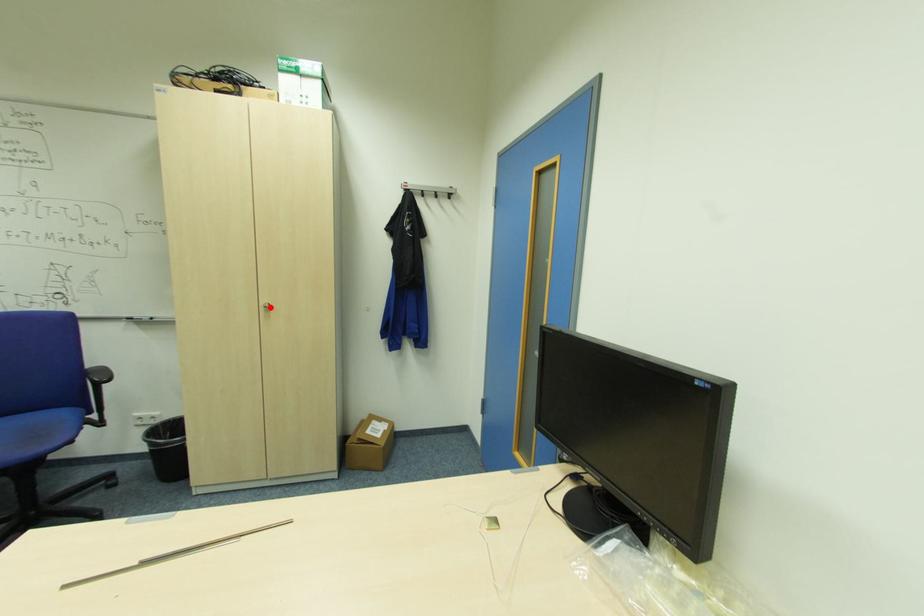
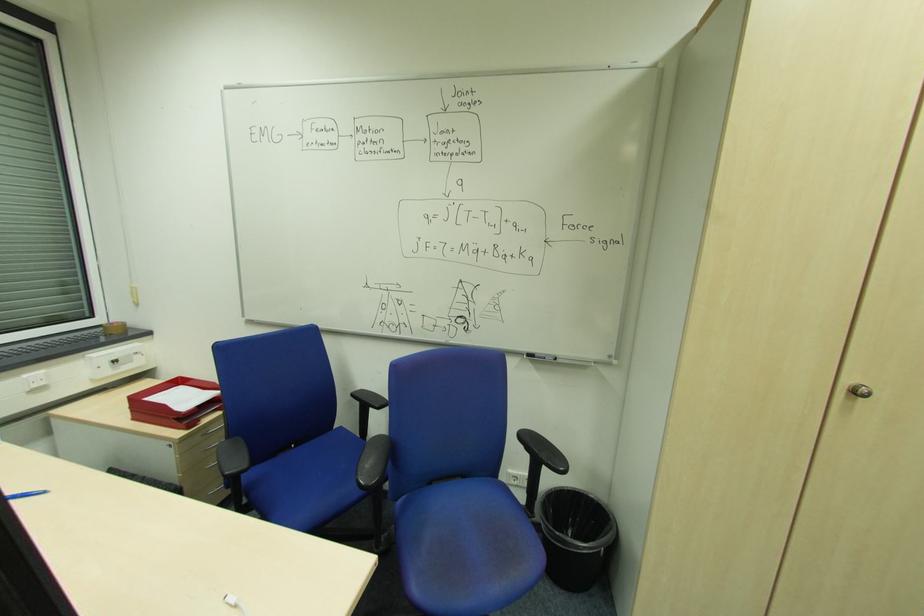
Locate, in the second image, the point that corresponds to the highlighted location in the first image.

(860, 392)